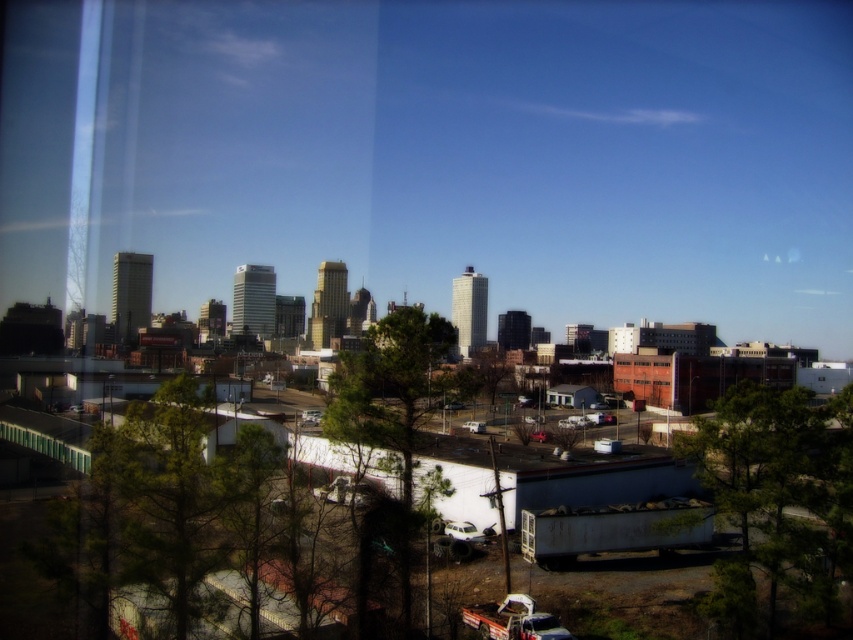
You are standing at the window looking out at the cityscape. You notice the green matte tree at right and the green leafy tree at center. Which tree is positioned lower in the scene?

The green matte tree at right is positioned lower because it is below the green leafy tree at center.